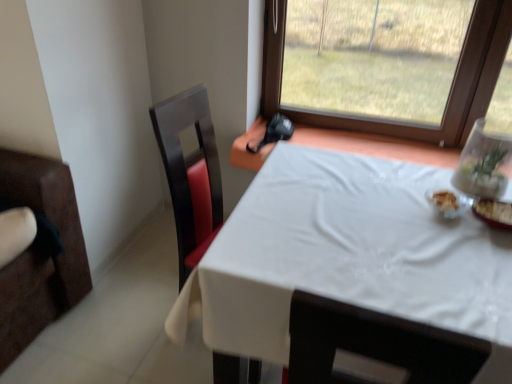
Find the location of `vacant position to the left of white glossy bowl at upper right`. vacant position to the left of white glossy bowl at upper right is located at coordinates (390, 212).